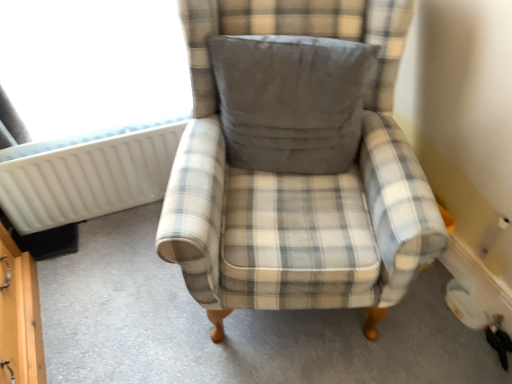
Question: Would you say white plastic radiator at left is to the left or to the right of transparent plastic radiator at upper left in the picture?

Choices:
 (A) right
 (B) left

Answer: (B)

Question: From their relative heights in the image, would you say white plastic radiator at left is taller or shorter than transparent plastic radiator at upper left?

Choices:
 (A) tall
 (B) short

Answer: (B)

Question: Estimate the real-world distances between objects in this image. Which object is closer to the white plastic radiator at left?

Choices:
 (A) transparent plastic radiator at upper left
 (B) plaid fabric armchair at center
 (C) gray fabric pillow at center

Answer: (A)

Question: Which object is the closest to the transparent plastic radiator at upper left?

Choices:
 (A) white plastic radiator at left
 (B) gray fabric pillow at center
 (C) plaid fabric armchair at center

Answer: (A)